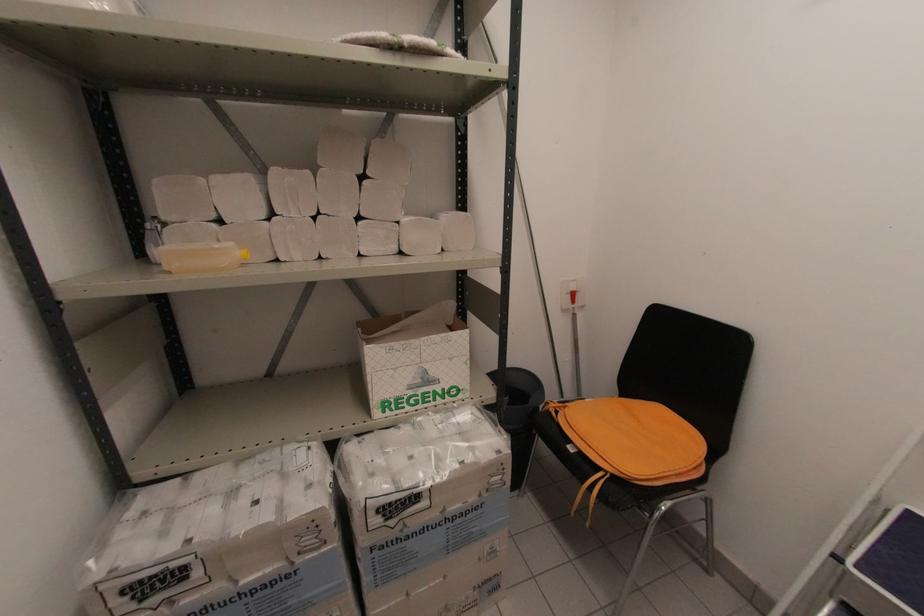
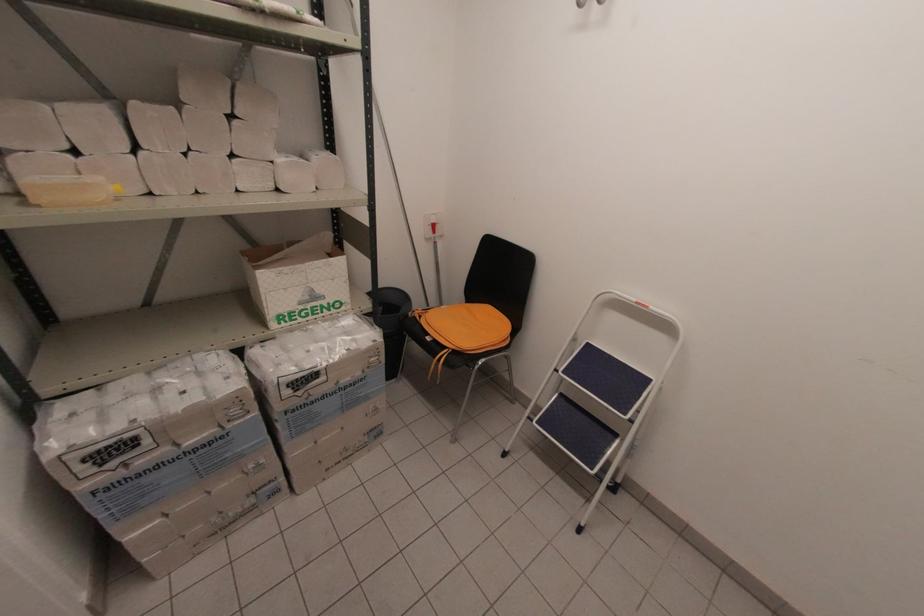
Find the pixel in the second image that matches pixel 419 381 in the first image.

(309, 298)